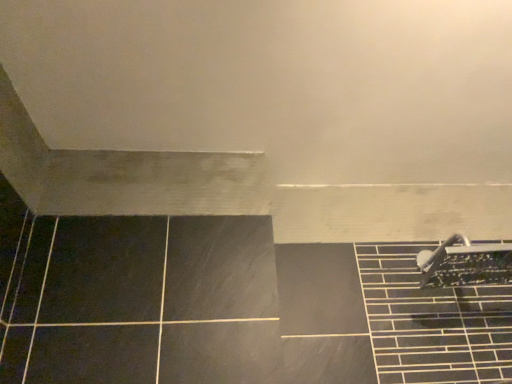
Describe the element at coordinates (432, 322) in the screenshot. I see `metallic silver stairs at lower right` at that location.

The height and width of the screenshot is (384, 512). I want to click on metallic silver stairs at lower right, so click(x=432, y=322).

In the scene shown: What is the approximate width of metallic silver stairs at lower right?

metallic silver stairs at lower right is 3.03 inches in width.

Measure the distance between point (393, 291) and camera.

Point (393, 291) and camera are 4.55 feet apart.

You are a GUI agent. You are given a task and a screenshot of the screen. Output one action in this format:
    pyautogui.click(x=<x>, y=<y>)
    Task: Click on the metallic silver stairs at lower right
    This screenshot has height=384, width=512.
    Given the screenshot: What is the action you would take?
    pyautogui.click(x=432, y=322)